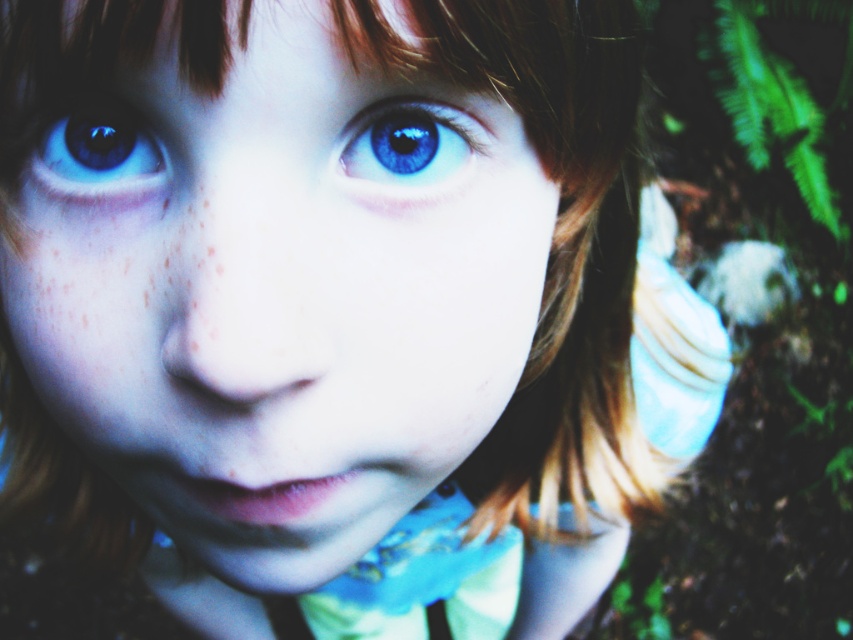
You are a photographer adjusting the lighting for a portrait. You notice the blue glossy eye at upper center and the blue glossy eye at upper left in the image. Which eye is positioned lower in the frame?

The blue glossy eye at upper center is located below the blue glossy eye at upper left, so it is positioned lower in the frame.

Based on the scene description, which object is bigger between the smooth skin face at center and the blue glossy eye at upper center?

The smooth skin face at center is larger in size compared to the blue glossy eye at upper center according to the description.

You are a photographer adjusting the focus on a camera. You need to ensure that both the smooth skin face at center and the blue glossy eye at upper left are in focus. Given their sizes, which object should you prioritize focusing on first?

The smooth skin face at center should be prioritized for focus first because it is larger than the blue glossy eye at upper left, making it more prominent in the composition.